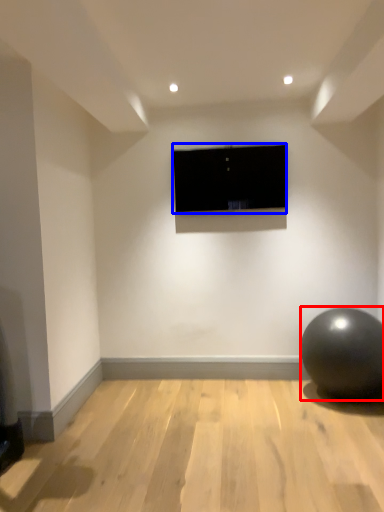
Question: Which point is further to the camera, ball (highlighted by a red box) or television (highlighted by a blue box)?

Choices:
 (A) ball
 (B) television

Answer: (B)